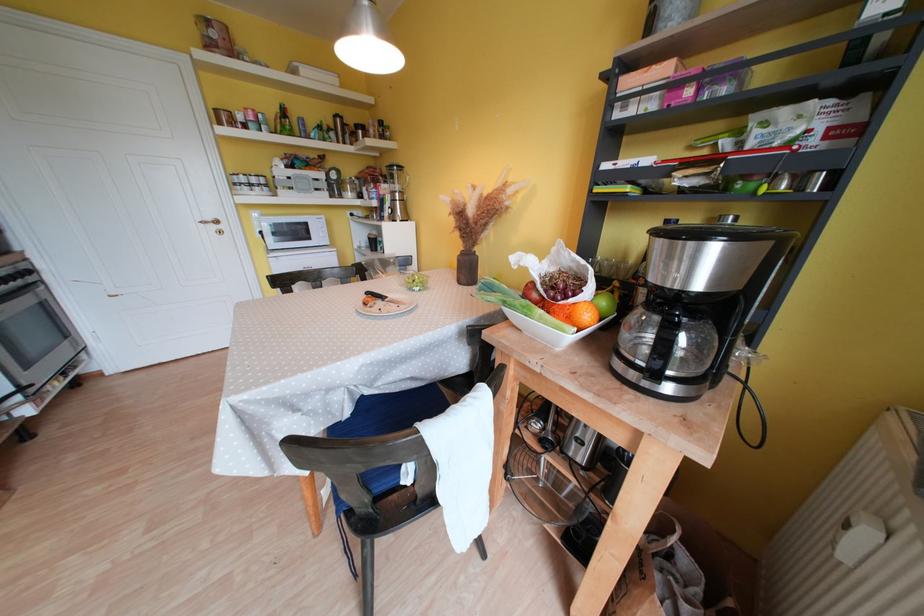
Locate an element on the screen. glass lid handle is located at coordinates (662, 347).